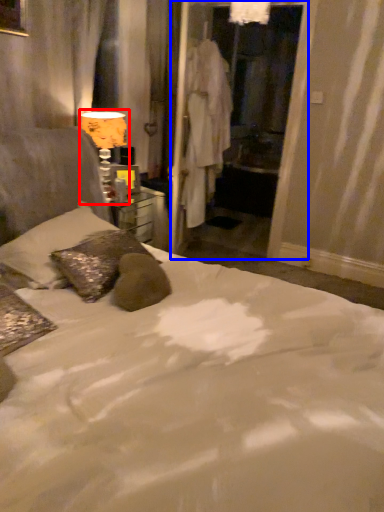
Question: Which object appears closest to the camera in this image, table lamp (highlighted by a red box) or screen door (highlighted by a blue box)?

Choices:
 (A) table lamp
 (B) screen door

Answer: (A)